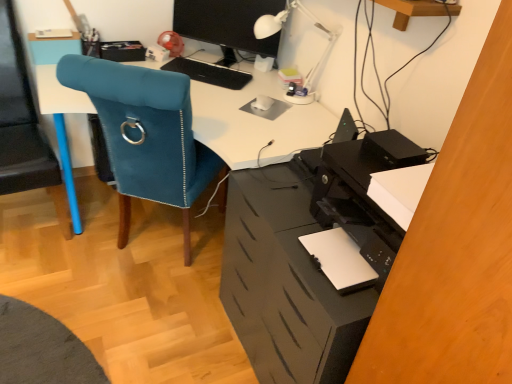
Identify the location of free region under white plastic table lamp at upper center (from a real-world perspective). The width and height of the screenshot is (512, 384). (278, 94).